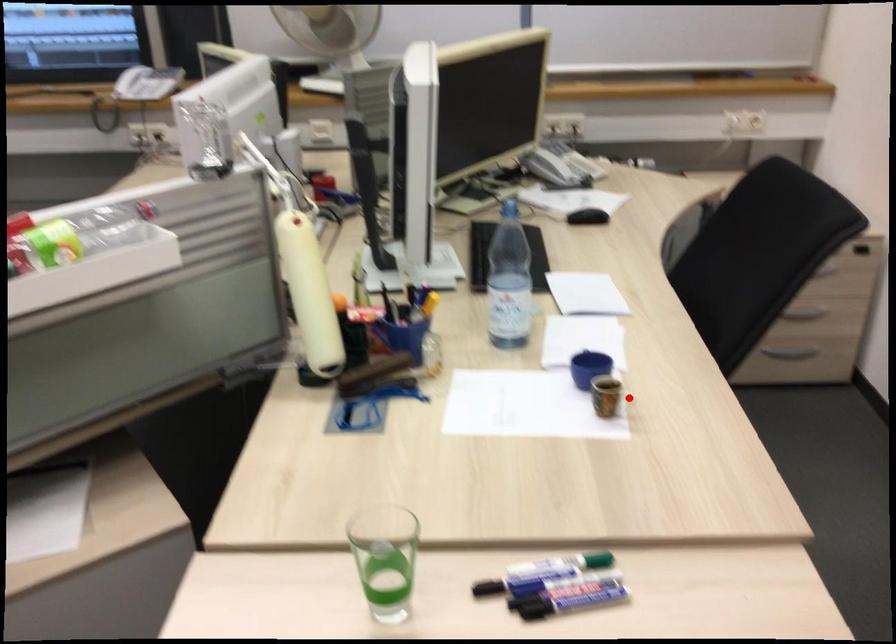
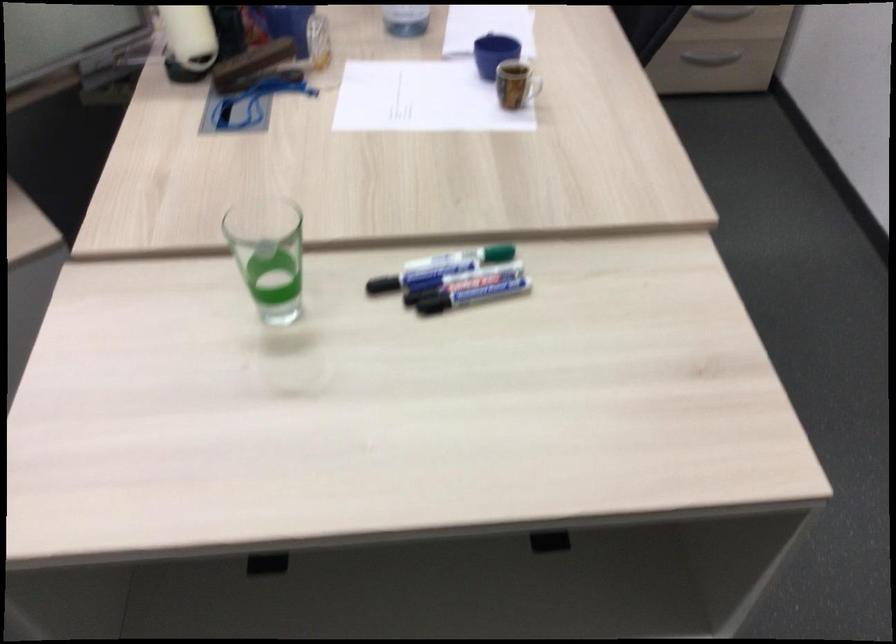
Where in the second image is the point corresponding to the highlighted location from the first image?

(531, 88)